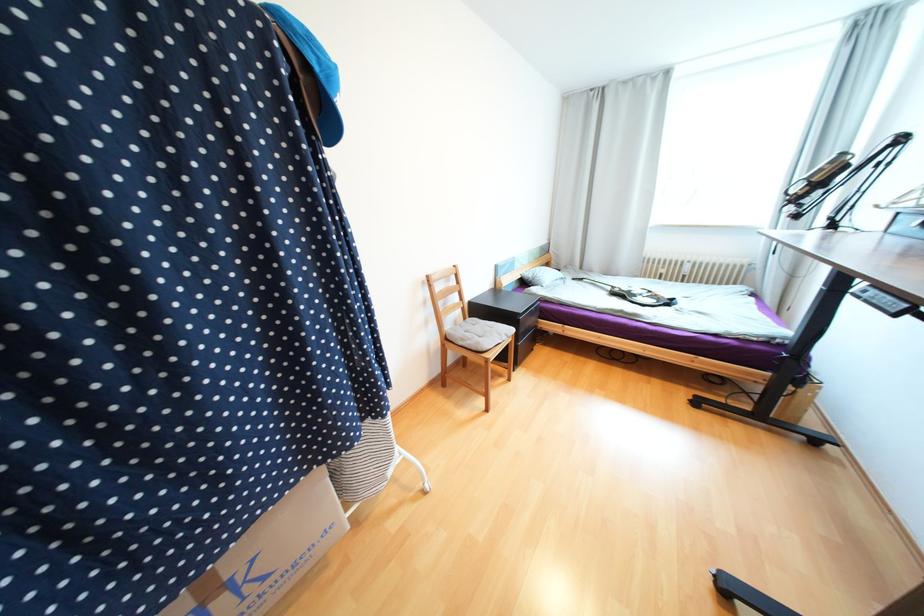
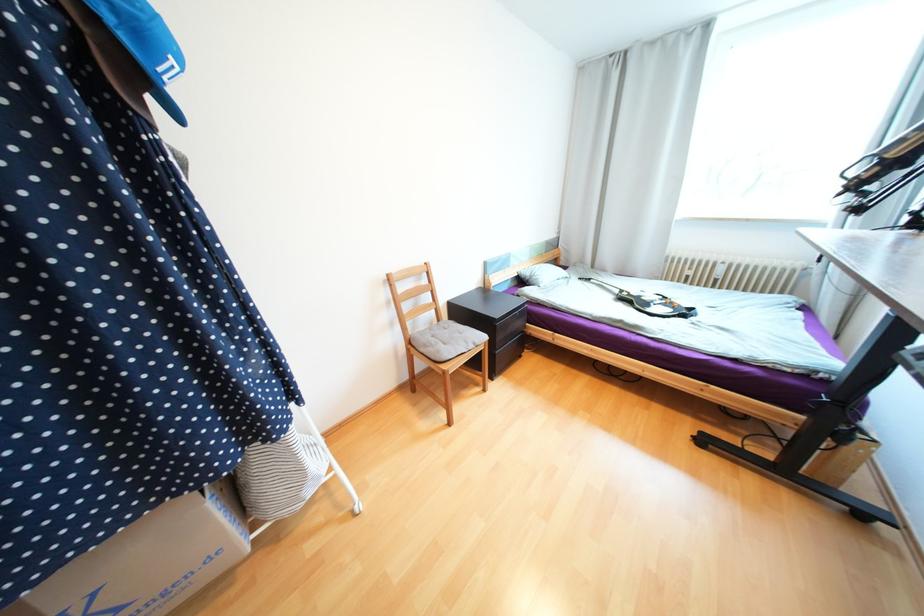
The images are taken continuously from a first-person perspective. In which direction are you moving?

The movement direction of the cameraman is right, forward.